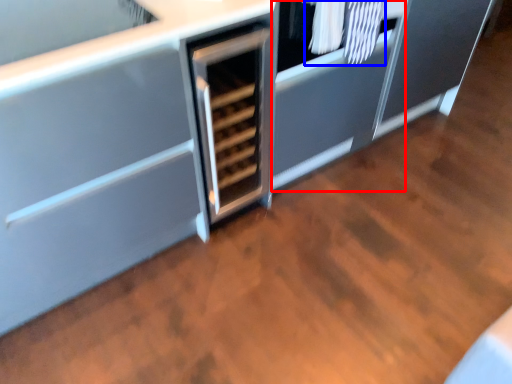
Question: Which point is closer to the camera, cabinetry (highlighted by a red box) or laundry (highlighted by a blue box)?

Choices:
 (A) cabinetry
 (B) laundry

Answer: (B)